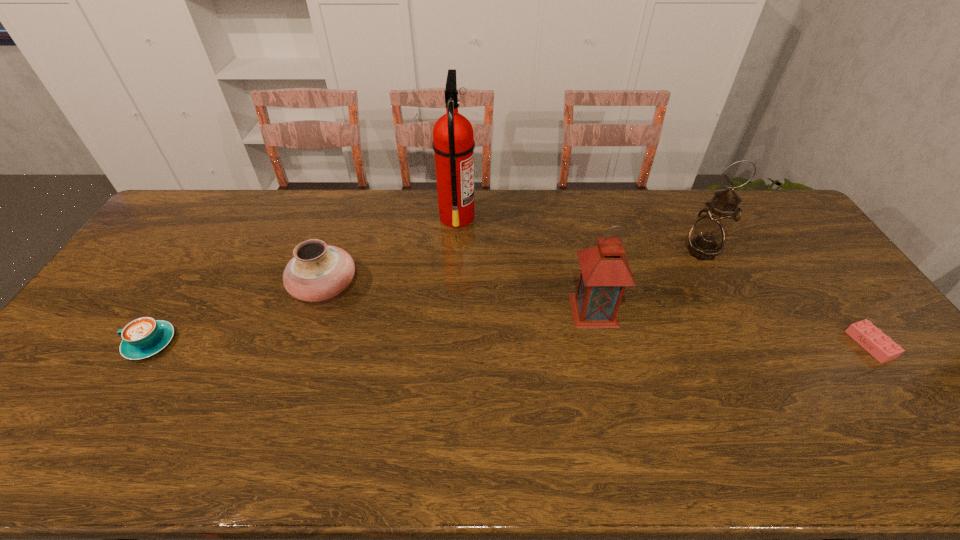
Where is `object present at the right edge`? object present at the right edge is located at coordinates (872, 339).

Find the location of a particular element. The image size is (960, 540). free region at the far edge of the desktop is located at coordinates tap(264, 228).

Where is `vacant region at the near edge of the desktop`? Image resolution: width=960 pixels, height=540 pixels. vacant region at the near edge of the desktop is located at coordinates (356, 450).

Where is `free space at the left edge`? The height and width of the screenshot is (540, 960). free space at the left edge is located at coordinates (156, 249).

In the image, there is a desktop. Identify the location of vacant space at the far left corner. The width and height of the screenshot is (960, 540). pyautogui.click(x=184, y=211).

Identify the location of vacant space that's between the lantern and the pottery. This screenshot has height=540, width=960. (459, 299).

What are the coordinates of `free space between the fire extinguisher and the fourth tallest object` in the screenshot? It's located at (391, 252).

The image size is (960, 540). Find the location of `vacant space that's between the oil lamp and the shortest object`. vacant space that's between the oil lamp and the shortest object is located at coordinates (786, 298).

Image resolution: width=960 pixels, height=540 pixels. Identify the location of vacant area between the third object from right to left and the cappuccino. click(x=372, y=327).

The image size is (960, 540). What are the coordinates of `free spot between the fire extinguisher and the lantern` in the screenshot? It's located at (525, 264).